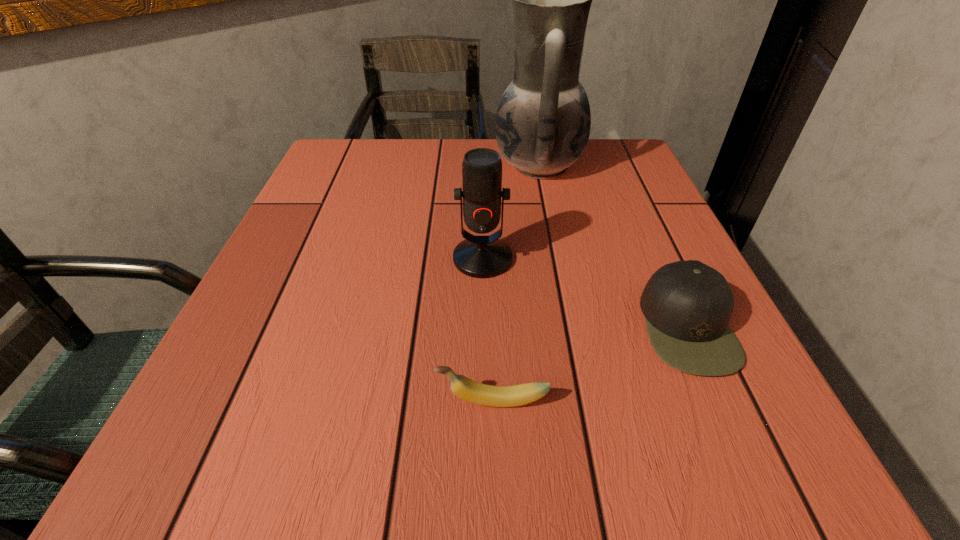
Image resolution: width=960 pixels, height=540 pixels. What are the coordinates of `the tallest object` in the screenshot? It's located at coord(543,120).

What are the coordinates of `the farthest object` in the screenshot? It's located at (543, 120).

The height and width of the screenshot is (540, 960). In order to click on the second farthest object in this screenshot , I will do `click(477, 256)`.

This screenshot has height=540, width=960. I want to click on the third shortest object, so click(477, 256).

Locate an element on the screen. The height and width of the screenshot is (540, 960). the third farthest object is located at coordinates (687, 305).

Where is `the second shortest object`? The image size is (960, 540). the second shortest object is located at coordinates (687, 305).

I want to click on banana, so click(487, 395).

This screenshot has width=960, height=540. I want to click on the nearest object, so click(x=487, y=395).

Locate an element on the screen. vacant area situated on the front-facing side of the farthest object is located at coordinates click(x=419, y=166).

What are the coordinates of `vacant space located 0.220m on the front-facing side of the farthest object` in the screenshot? It's located at (401, 166).